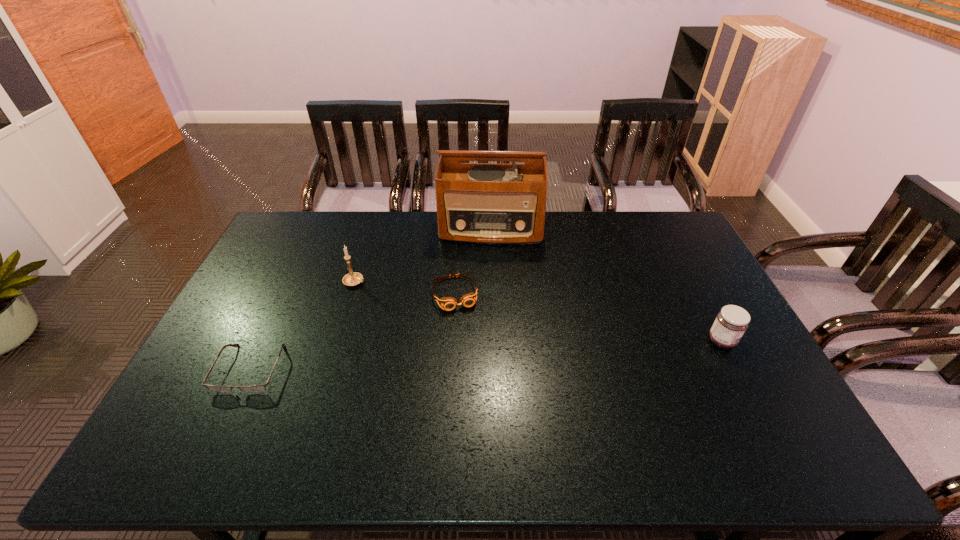
The image size is (960, 540). In order to click on free space between the third shortest object and the radio receiver in this screenshot , I will do `click(607, 285)`.

Find the location of a particular element. vacant space that is in between the jam and the goggles is located at coordinates (588, 318).

Identify the location of empty space that is in between the shortest object and the farthest object. tap(372, 299).

The height and width of the screenshot is (540, 960). What are the coordinates of `free space between the rightmost object and the leftmost object` in the screenshot? It's located at (486, 355).

I want to click on unoccupied position between the second shortest object and the candle holder, so click(405, 288).

Where is `vacant space that's between the radio receiver and the fourth object from right to left`? vacant space that's between the radio receiver and the fourth object from right to left is located at coordinates (423, 255).

Find the location of a particular element. This screenshot has width=960, height=540. vacant area that lies between the rightmost object and the radio receiver is located at coordinates (607, 285).

Where is `free spot between the goggles and the third tallest object`? free spot between the goggles and the third tallest object is located at coordinates (588, 318).

Identify which object is located as the nearest to the third tallest object. Please provide its 2D coordinates. Your answer should be formatted as a tuple, i.e. [(x, y)], where the tuple contains the x and y coordinates of a point satisfying the conditions above.

[(485, 203)]

The height and width of the screenshot is (540, 960). I want to click on object that stands as the second closest to the second shortest object, so click(353, 278).